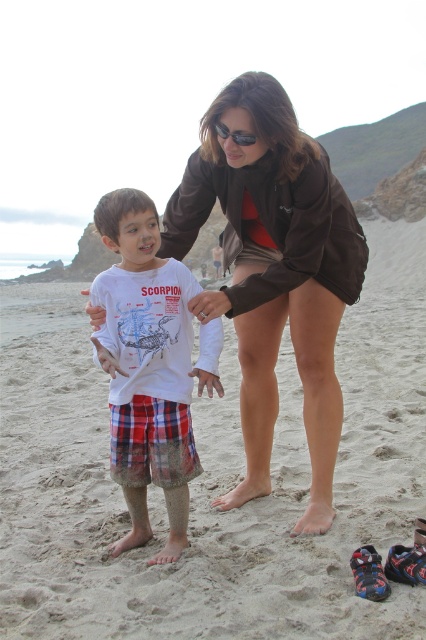
From the picture: Between sandy beach at center and white cotton shirt at center, which one has less height?

With less height is white cotton shirt at center.

Who is more forward, (370, 228) or (141, 512)?

Point (141, 512)

Locate an element on the screen. sandy beach at center is located at coordinates (213, 481).

Who is lower down, brown fabric at center or black plastic sunglasses at upper center?

brown fabric at center is lower down.

Does brown fabric at center have a lesser width compared to black plastic sunglasses at upper center?

In fact, brown fabric at center might be wider than black plastic sunglasses at upper center.

Which is behind, point (256, 282) or point (252, 141)?

Point (256, 282)

You are a GUI agent. You are given a task and a screenshot of the screen. Output one action in this format:
    pyautogui.click(x=<x>, y=<y>)
    Task: Click on the brown fabric at center
    The width and height of the screenshot is (426, 640).
    Given the screenshot: What is the action you would take?
    (x=273, y=273)

Is point (249, 218) less distant than point (164, 259)?

No, it is not.

Between brown fabric at center and white cotton shirt at center, which one is positioned lower?

Positioned lower is white cotton shirt at center.

Is point (265, 164) more distant than point (137, 403)?

That is True.

Find the location of a particular element. brown fabric at center is located at coordinates (273, 273).